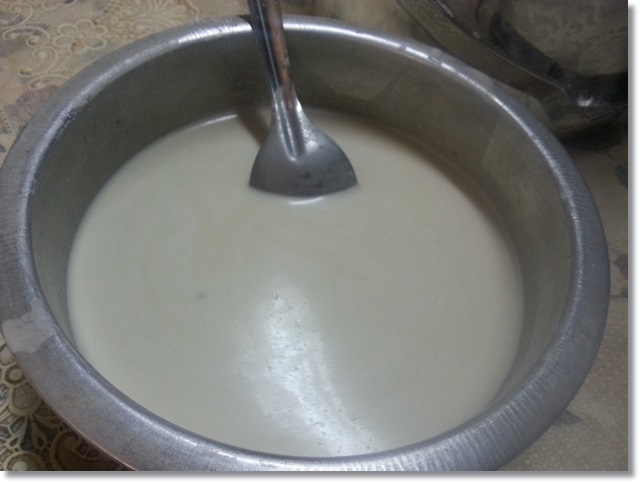
Identify the location of top right corner table cover. (595, 20).